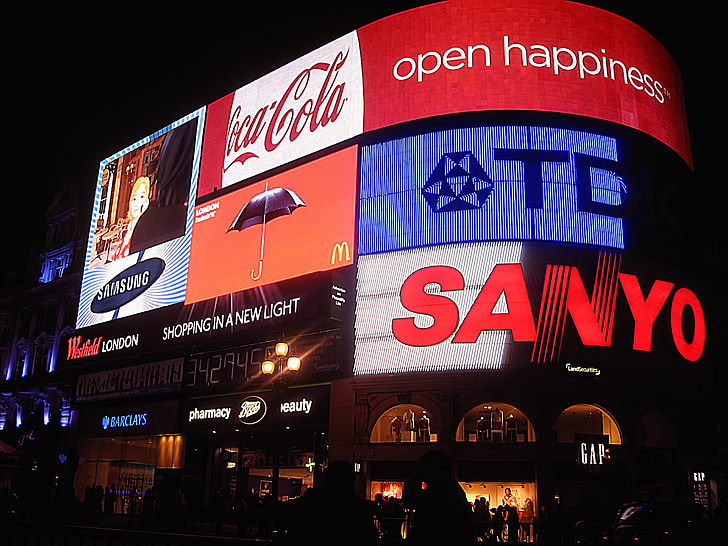
The image size is (728, 546). What are the coordinates of `lamp` in the screenshot? It's located at (282, 375).